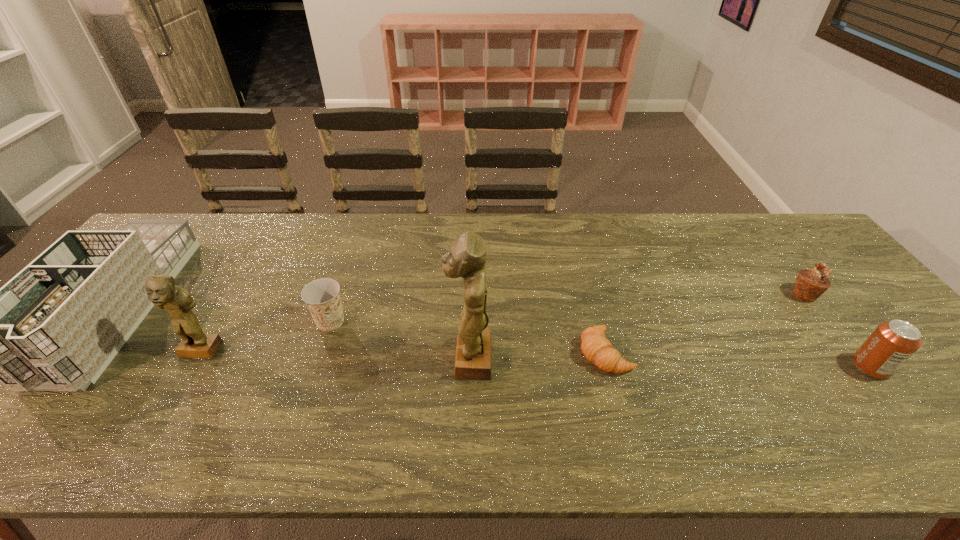
You are a GUI agent. You are given a task and a screenshot of the screen. Output one action in this format:
    pyautogui.click(x=<x>, y=<y>)
    Task: Click on the second object from left to right
    
    Given the screenshot: What is the action you would take?
    pyautogui.click(x=161, y=289)

You are a GUI agent. You are given a task and a screenshot of the screen. Output one action in this format:
    pyautogui.click(x=<x>, y=<y>)
    Task: Click on the second tallest object
    This screenshot has width=960, height=540.
    Given the screenshot: What is the action you would take?
    pyautogui.click(x=161, y=289)

The height and width of the screenshot is (540, 960). Find the location of `the tallest object`. the tallest object is located at coordinates (467, 258).

This screenshot has width=960, height=540. I want to click on the right figurine, so click(x=467, y=258).

This screenshot has height=540, width=960. Identify the location of Dixie cup. (322, 296).

You are a GUI agent. You are given a task and a screenshot of the screen. Output one action in this format:
    pyautogui.click(x=<x>, y=<y>)
    Task: Click on the fourth shortest object
    
    Given the screenshot: What is the action you would take?
    pyautogui.click(x=892, y=343)

Find the location of a particular element. The image size is (960, 540). the fifth object from left to right is located at coordinates (598, 350).

You are a GUI agent. You are given a task and a screenshot of the screen. Output one action in this format:
    pyautogui.click(x=<x>, y=<y>)
    Task: Click on the crescent roll
    This screenshot has height=540, width=960.
    Given the screenshot: What is the action you would take?
    pyautogui.click(x=598, y=350)

Locate an element on the screen. The height and width of the screenshot is (540, 960). the leftmost object is located at coordinates (55, 326).

Image resolution: width=960 pixels, height=540 pixels. I want to click on the third tallest object, so point(55,326).